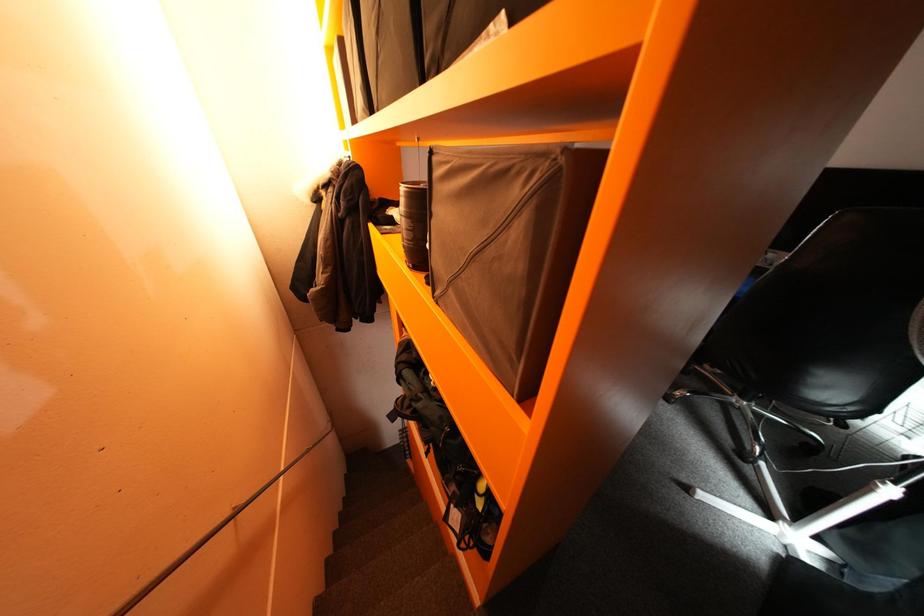
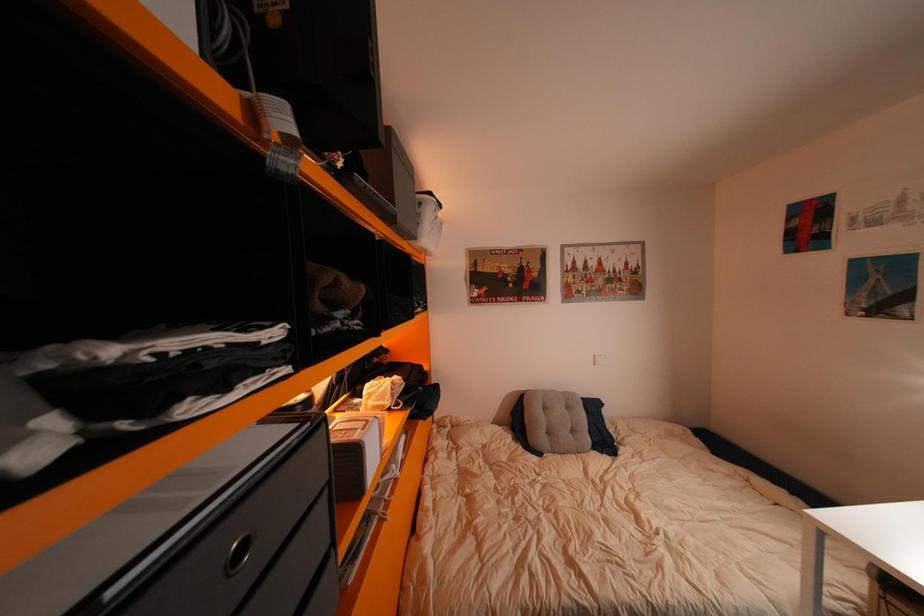
How did the camera likely rotate?

The rotation direction of the camera is left-up.